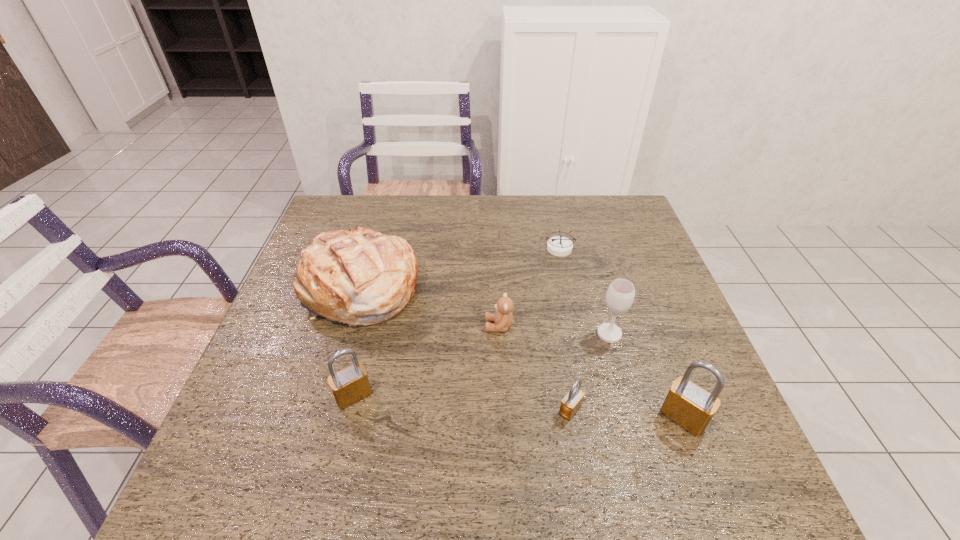
This screenshot has height=540, width=960. Find the location of `the leftmost padlock`. the leftmost padlock is located at coordinates (351, 384).

Locate an element on the screen. The height and width of the screenshot is (540, 960). the shortest padlock is located at coordinates (571, 403).

Image resolution: width=960 pixels, height=540 pixels. Find the location of `the rightmost object`. the rightmost object is located at coordinates (687, 404).

The image size is (960, 540). Identify the location of the shortest object. (559, 246).

The image size is (960, 540). Find the location of `wineglass`. wineglass is located at coordinates pos(620,295).

Locate an element on the screen. The image size is (960, 540). bread is located at coordinates (361, 277).

Locate an element on the screen. teddy bear is located at coordinates (503, 318).

Locate an element on the screen. Image resolution: width=960 pixels, height=540 pixels. free spot located 0.200m on the right of the leftmost padlock is located at coordinates (465, 396).

This screenshot has height=540, width=960. What are the coordinates of `vacant space situated on the left of the second padlock from right to left` in the screenshot? It's located at (482, 410).

This screenshot has width=960, height=540. Find the location of `vacant region located on the left of the rightmost padlock`. vacant region located on the left of the rightmost padlock is located at coordinates (540, 417).